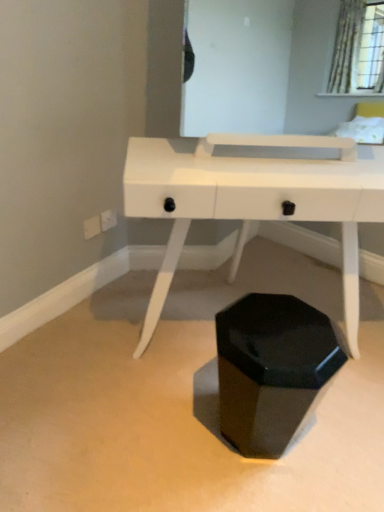
Describe the element at coordinates (254, 199) in the screenshot. I see `white glossy desk at center` at that location.

Identify the location of white glossy desk at center. (254, 199).

Measure the distance between point (245, 398) and camera.

Point (245, 398) is 1.45 meters from camera.

At what (x,y) coordinates should I click in order to perform the action: click on black glossy hexagonal at center. Please return your answer as a coordinate pair (x, y). Looking at the image, I should click on pos(271,369).

In order to face black glossy hexagonal at center, should I rotate leftwards or rightwards?

Turn right approximately 9.208 degrees to face it.

This screenshot has width=384, height=512. What do you see at coordinates (271, 369) in the screenshot?
I see `black glossy hexagonal at center` at bounding box center [271, 369].

Find the location of `white glossy desk at center`. white glossy desk at center is located at coordinates (254, 199).

Visually, is white glossy desk at center positioned to the left or to the right of black glossy hexagonal at center?

Clearly, white glossy desk at center is on the right of black glossy hexagonal at center in the image.

Is white glossy desk at center in front of or behind black glossy hexagonal at center in the image?

Visually, white glossy desk at center is located behind black glossy hexagonal at center.

Which is closer to the camera, (232, 207) or (293, 404)?

Clearly, point (232, 207) is closer to the camera than point (293, 404).

From the image's perspective, is white glossy desk at center on black glossy hexagonal at center?

Yes, from the image's perspective, white glossy desk at center is on top of black glossy hexagonal at center.

From a real-world perspective, is white glossy desk at center on top of black glossy hexagonal at center?

Yes, from a real-world perspective, white glossy desk at center is over black glossy hexagonal at center

In terms of width, does white glossy desk at center look wider or thinner when compared to black glossy hexagonal at center?

In the image, white glossy desk at center appears to be wider than black glossy hexagonal at center.

Between white glossy desk at center and black glossy hexagonal at center, which one has more height?

white glossy desk at center is taller.

Is white glossy desk at center bigger or smaller than black glossy hexagonal at center?

white glossy desk at center is bigger than black glossy hexagonal at center.

Is black glossy hexagonal at center surrounded by white glossy desk at center?

That's incorrect, black glossy hexagonal at center is not inside white glossy desk at center.

Are white glossy desk at center and black glossy hexagonal at center located far from each other?

white glossy desk at center is near black glossy hexagonal at center, not far away.

Is white glossy desk at center facing towards black glossy hexagonal at center?

Yes, white glossy desk at center is oriented towards black glossy hexagonal at center.

Can you tell me how much white glossy desk at center and black glossy hexagonal at center differ in facing direction?

They differ by 173 degrees in their facing directions.

How far apart are white glossy desk at center and black glossy hexagonal at center?

A distance of 15.93 inches exists between white glossy desk at center and black glossy hexagonal at center.

This screenshot has height=512, width=384. I want to click on desk behind the black glossy hexagonal at center, so click(x=254, y=199).

Is black glossy hexagonal at center at the right side of white glossy desk at center?

Incorrect, black glossy hexagonal at center is not on the right side of white glossy desk at center.

Considering the positions of objects black glossy hexagonal at center and white glossy desk at center in the image provided, who is in front, black glossy hexagonal at center or white glossy desk at center?

Positioned in front is black glossy hexagonal at center.

Does point (241, 345) appear closer or farther from the camera than point (226, 193)?

Clearly, point (241, 345) is more distant from the camera than point (226, 193).

From the image's perspective, is black glossy hexagonal at center below white glossy desk at center?

Yes.

From a real-world perspective, is black glossy hexagonal at center physically above white glossy desk at center?

No, from a real-world perspective, black glossy hexagonal at center is not on top of white glossy desk at center.

Considering the relative sizes of black glossy hexagonal at center and white glossy desk at center in the image provided, is black glossy hexagonal at center wider than white glossy desk at center?

No.

Is black glossy hexagonal at center taller than white glossy desk at center?

In fact, black glossy hexagonal at center may be shorter than white glossy desk at center.

Is black glossy hexagonal at center bigger than white glossy desk at center?

Incorrect, black glossy hexagonal at center is not larger than white glossy desk at center.

Is white glossy desk at center surrounded by black glossy hexagonal at center?

No, white glossy desk at center is not surrounded by black glossy hexagonal at center.

Is black glossy hexagonal at center far away from white glossy desk at center?

black glossy hexagonal at center is actually quite close to white glossy desk at center.

Could you tell me if black glossy hexagonal at center is facing white glossy desk at center?

Yes, black glossy hexagonal at center is turned towards white glossy desk at center.

Can you tell me how much black glossy hexagonal at center and white glossy desk at center differ in facing direction?

There is a 173-degree angle between the facing directions of black glossy hexagonal at center and white glossy desk at center.

This screenshot has width=384, height=512. I want to click on desk on the right of black glossy hexagonal at center, so click(254, 199).

The image size is (384, 512). I want to click on desk that appears behind the black glossy hexagonal at center, so click(x=254, y=199).

Locate an element on the screen. This screenshot has width=384, height=512. waste container lying below the white glossy desk at center (from the image's perspective) is located at coordinates (271, 369).